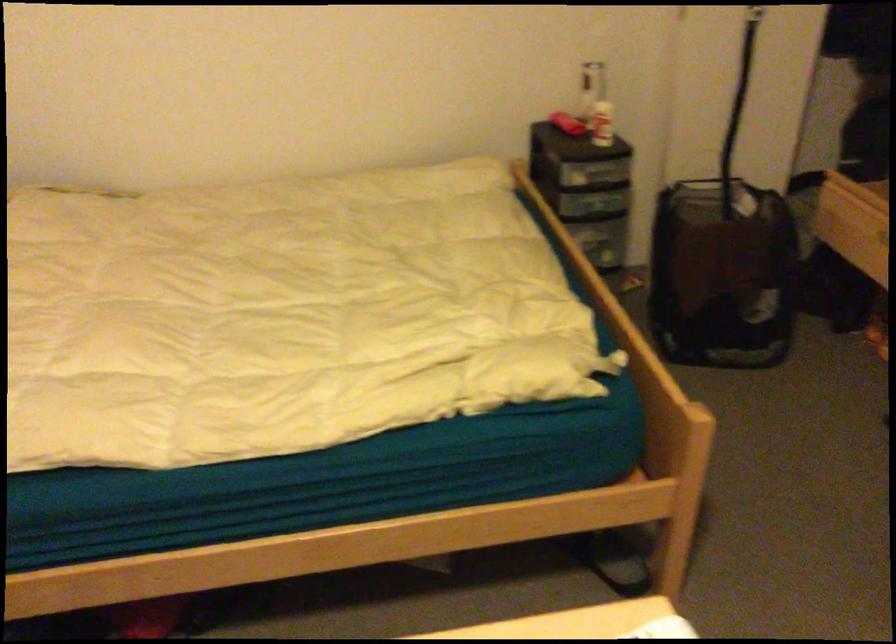
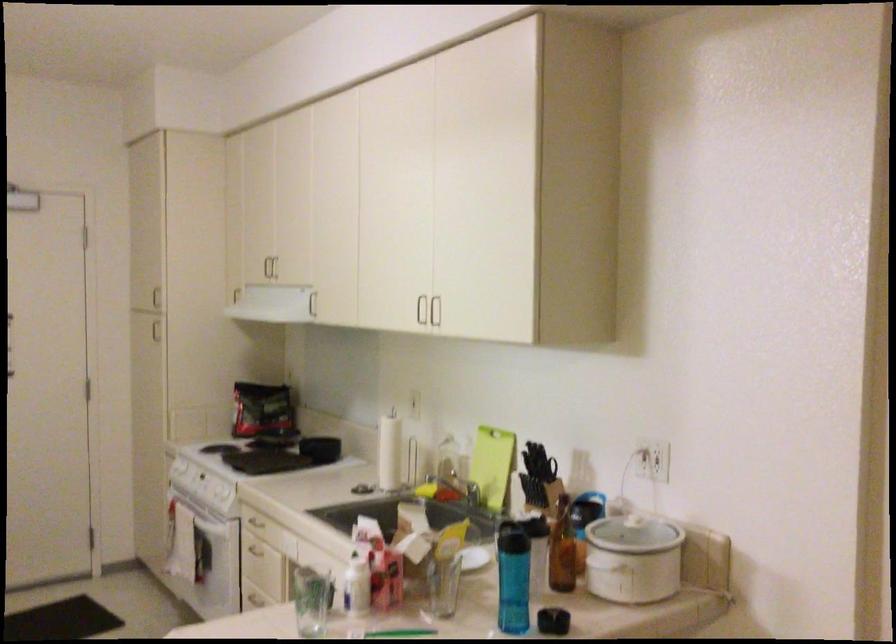
Based on the continuous images, in which direction is the camera rotating?

The camera's rotation is toward right-down.